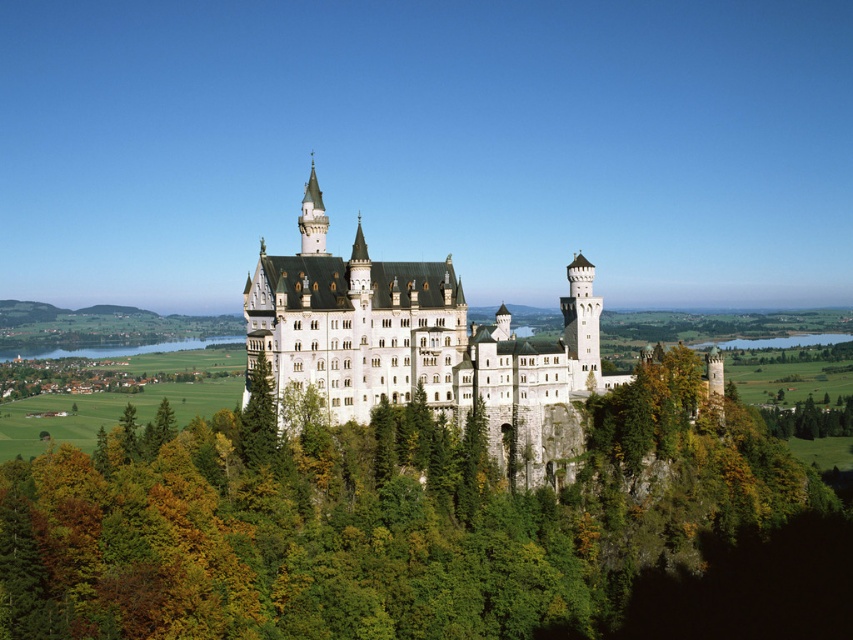
You are a tourist visiting Neuschwanstein Castle and want to take a photo that includes both the green leafy tree at center and the white stone castle at center. Which object should you position closer to the camera to ensure both are fully visible in the frame?

To ensure both the green leafy tree at center and the white stone castle at center are fully visible in the frame, you should position the green leafy tree at center closer to the camera since it is smaller in size compared to the white stone castle at center.

You are standing at the base of Neuschwanstein Castle and want to take a photo that includes both the central tower and a distant lake. The central tower is located at point (466, 540), and the lake is near point (517, 371). Which point is closer to you, the photographer, so you can ensure both are in frame?

Point (466, 540) is closer to the viewer than point (517, 371), so the central tower at point (466, 540) will be nearer to you, allowing both it and the lake at point (517, 371) to be captured in the photo frame.